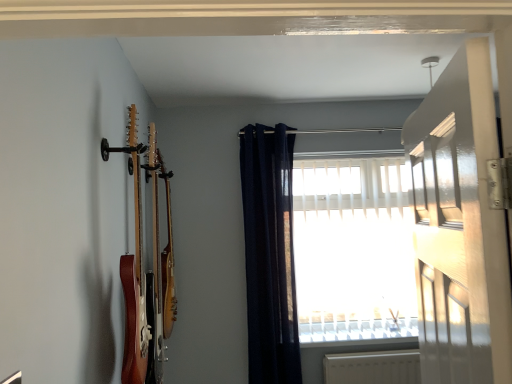
Question: Considering the relative positions of white glossy door at upper right and wooden acoustic guitar at left, which ranks as the second guitar in front-to-back order, in the image provided, is white glossy door at upper right behind wooden acoustic guitar at left, which ranks as the second guitar in front-to-back order,?

Choices:
 (A) yes
 (B) no

Answer: (B)

Question: From the image's perspective, is white glossy door at upper right beneath wooden acoustic guitar at left, which ranks as the second guitar in front-to-back order?

Choices:
 (A) no
 (B) yes

Answer: (A)

Question: Is wooden acoustic guitar at left, which ranks as the second guitar in front-to-back order, located within white glossy door at upper right?

Choices:
 (A) yes
 (B) no

Answer: (B)

Question: Does white glossy door at upper right appear on the left side of wooden acoustic guitar at left, which ranks as the second guitar in front-to-back order?

Choices:
 (A) yes
 (B) no

Answer: (B)

Question: Is white glossy door at upper right taller than wooden acoustic guitar at left, which is the 1th guitar from back to front?

Choices:
 (A) no
 (B) yes

Answer: (A)

Question: Is white glossy door at upper right placed right next to wooden acoustic guitar at left, which ranks as the second guitar in front-to-back order?

Choices:
 (A) yes
 (B) no

Answer: (B)

Question: Is white plastic window sill at lower center oriented away from wooden acoustic guitar at left, which ranks as the second guitar in front-to-back order?

Choices:
 (A) no
 (B) yes

Answer: (A)

Question: Can you confirm if white plastic window sill at lower center is positioned to the left of wooden acoustic guitar at left, which ranks as the second guitar in front-to-back order?

Choices:
 (A) yes
 (B) no

Answer: (B)

Question: From a real-world perspective, is white plastic window sill at lower center located beneath wooden acoustic guitar at left, which ranks as the second guitar in front-to-back order?

Choices:
 (A) no
 (B) yes

Answer: (B)

Question: Is white plastic window sill at lower center directly adjacent to wooden acoustic guitar at left, which is the 1th guitar from back to front?

Choices:
 (A) no
 (B) yes

Answer: (A)

Question: Does white plastic window sill at lower center have a greater height compared to wooden acoustic guitar at left, which ranks as the second guitar in front-to-back order?

Choices:
 (A) yes
 (B) no

Answer: (B)

Question: Can you confirm if white plastic window sill at lower center is thinner than wooden acoustic guitar at left, which ranks as the second guitar in front-to-back order?

Choices:
 (A) no
 (B) yes

Answer: (A)

Question: Is the surface of wooden acoustic guitar at left, which is the 1th guitar from back to front, in direct contact with white glossy door at upper right?

Choices:
 (A) yes
 (B) no

Answer: (B)